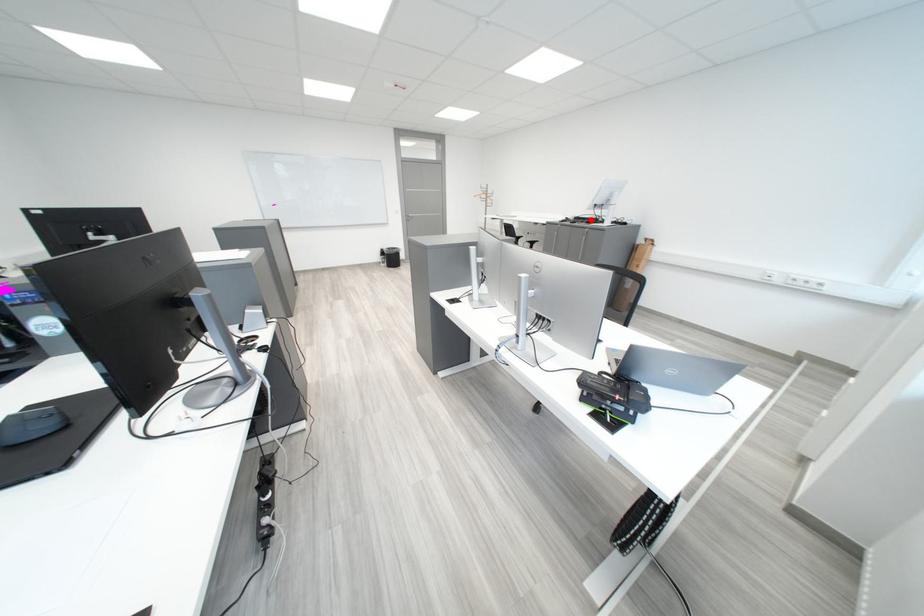
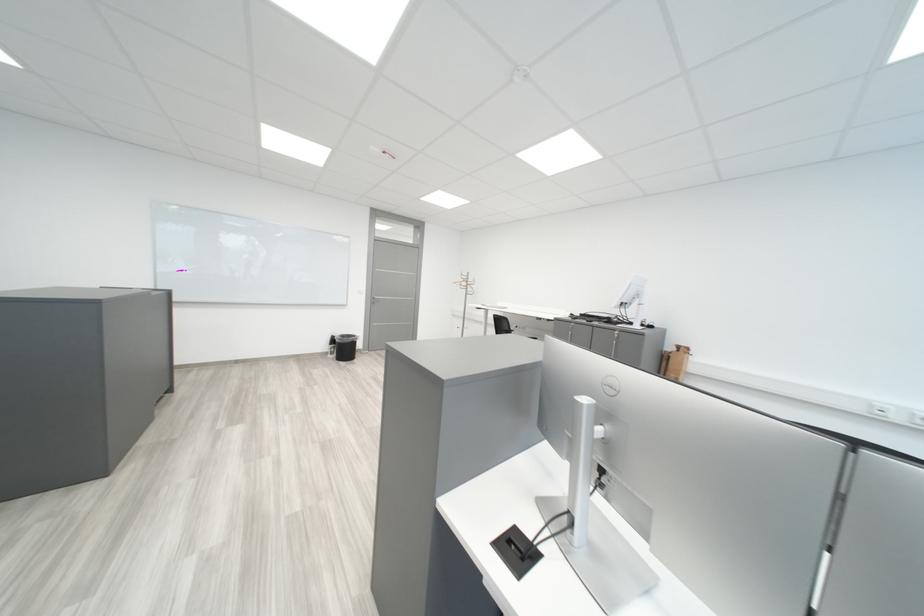
The point at the highlighted location is marked in the first image. Where is the corresponding point in the second image?

(598, 317)